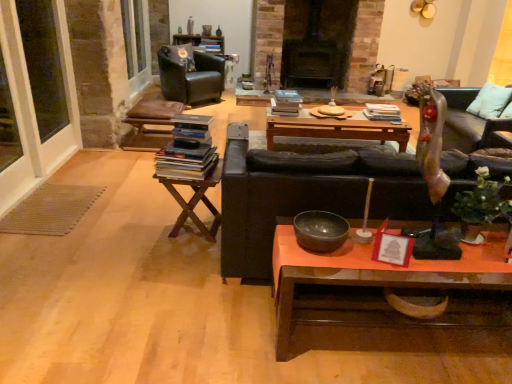
Where is `vacant space situated on the left part of woodenwoodentable at left`? This screenshot has height=384, width=512. vacant space situated on the left part of woodenwoodentable at left is located at coordinates (138, 226).